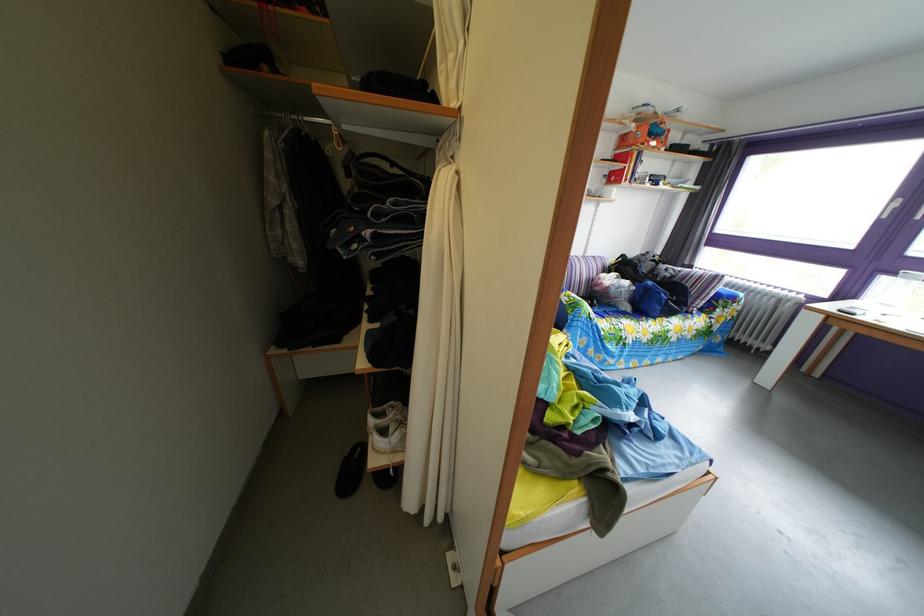
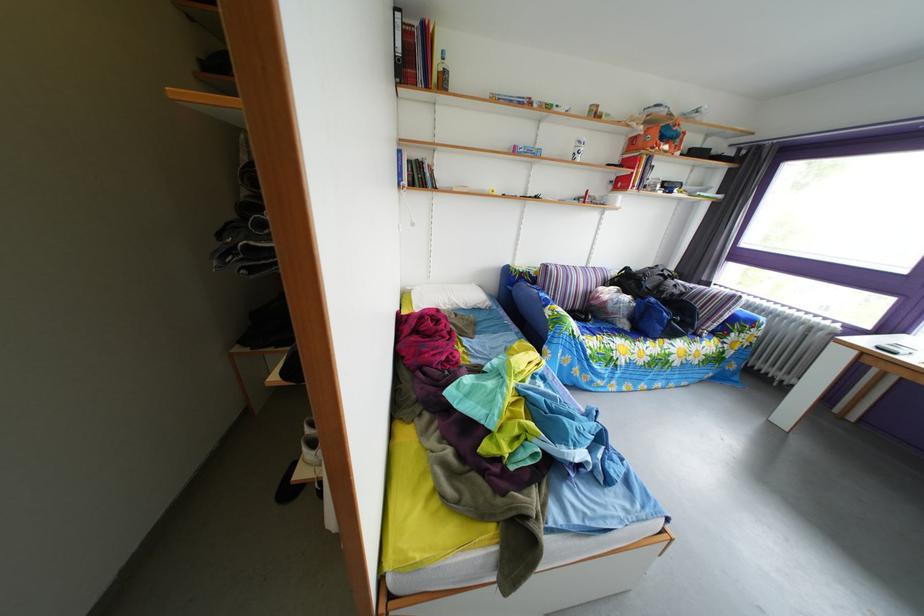
In the second image, find the point that corresponds to point 661,144 in the first image.

(673, 147)